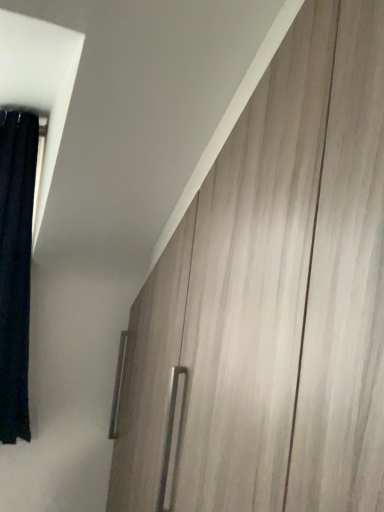
Question: From the image's perspective, is black fabric curtain at left above or below wooden cabinet at right?

Choices:
 (A) below
 (B) above

Answer: (B)

Question: Choose the correct answer: Is black fabric curtain at left inside wooden cabinet at right or outside it?

Choices:
 (A) inside
 (B) outside

Answer: (B)

Question: Is black fabric curtain at left taller or shorter than wooden cabinet at right?

Choices:
 (A) short
 (B) tall

Answer: (A)

Question: From the image's perspective, is wooden cabinet at right positioned above or below black fabric curtain at left?

Choices:
 (A) above
 (B) below

Answer: (B)

Question: Considering the positions of point (294, 27) and point (1, 221), is point (294, 27) closer or farther from the camera than point (1, 221)?

Choices:
 (A) closer
 (B) farther

Answer: (A)

Question: Is wooden cabinet at right inside the boundaries of black fabric curtain at left, or outside?

Choices:
 (A) outside
 (B) inside

Answer: (A)

Question: Considering the positions of wooden cabinet at right and black fabric curtain at left in the image, is wooden cabinet at right bigger or smaller than black fabric curtain at left?

Choices:
 (A) small
 (B) big

Answer: (B)